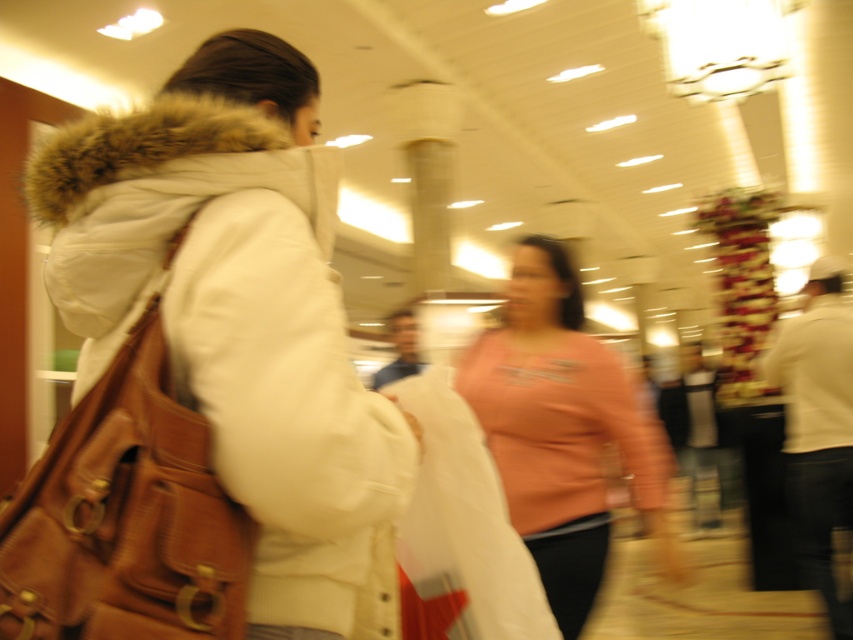
You are a photographer trying to adjust your focus. You notice the brown leather bag at left and the pink fabric shirt at center in your viewfinder. Which object should you focus on to ensure the other becomes more blurred?

You should focus on the brown leather bag at left because it is in front of the pink fabric shirt at center, so focusing on the closer object will make the background objects like the pink fabric shirt at center appear more blurred.